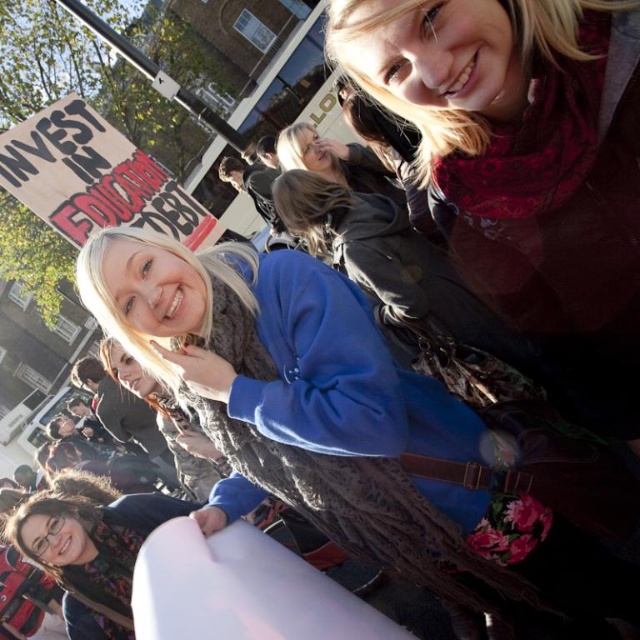
Question: Can you confirm if blue fleece sweater at center is positioned above matte red scarf at upper right?

Choices:
 (A) yes
 (B) no

Answer: (B)

Question: Can you confirm if blue fleece sweater at center is positioned to the right of matte red scarf at upper right?

Choices:
 (A) yes
 (B) no

Answer: (B)

Question: Which point is farther from the camera taking this photo?

Choices:
 (A) (397, 97)
 (B) (243, 493)

Answer: (B)

Question: Which point appears farthest from the camera in this image?

Choices:
 (A) (611, 42)
 (B) (456, 525)

Answer: (B)

Question: Considering the relative positions of blue fleece sweater at center and matte red scarf at upper right in the image provided, where is blue fleece sweater at center located with respect to matte red scarf at upper right?

Choices:
 (A) right
 (B) left

Answer: (B)